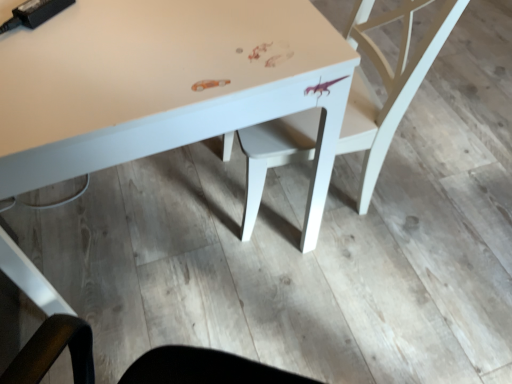
Identify the location of vacant space to the right of matte white table at center. This screenshot has height=384, width=512. (426, 210).